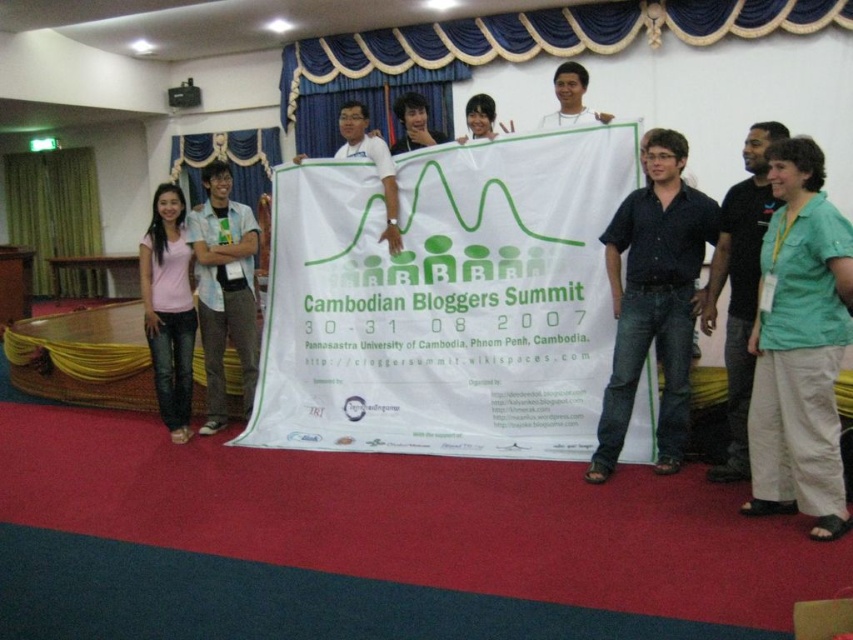
You are attending the Cambodian Bloggers Summit and notice two men wearing green shirts. One is wearing a green cotton shirt at center and the other a green shirt at right. If you need to pass between them, which direction should you move to ensure there is enough space?

The green cotton shirt at center is wider than the green shirt at right, so you should move towards the side of the green shirt at right to ensure there is enough space.

You are attending the Cambodian Bloggers Summit and notice two people wearing cotton shirts. One is wearing a green cotton shirt at center and another a pink cotton shirt at left. From your perspective facing the stage, which shirt is positioned more to the left?

The pink cotton shirt at left is positioned more to the left compared to the green cotton shirt at center.